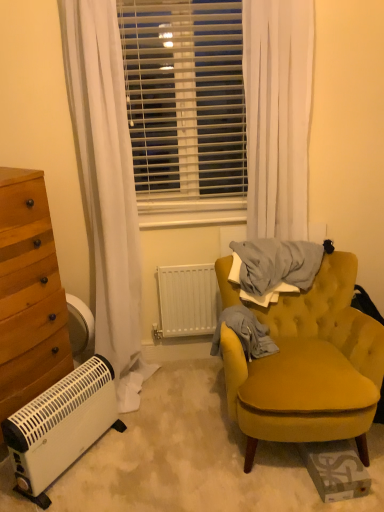
Question: From a real-world perspective, is white plastic blinds at center located higher than wooden chest of drawers at left?

Choices:
 (A) no
 (B) yes

Answer: (B)

Question: Is white plastic blinds at center far away from wooden chest of drawers at left?

Choices:
 (A) no
 (B) yes

Answer: (A)

Question: Would you say white plastic blinds at center contains wooden chest of drawers at left?

Choices:
 (A) no
 (B) yes

Answer: (A)

Question: Is white plastic blinds at center shorter than wooden chest of drawers at left?

Choices:
 (A) no
 (B) yes

Answer: (B)

Question: From a real-world perspective, is white plastic blinds at center located beneath wooden chest of drawers at left?

Choices:
 (A) no
 (B) yes

Answer: (A)

Question: Does white plastic blinds at center have a lesser width compared to wooden chest of drawers at left?

Choices:
 (A) no
 (B) yes

Answer: (B)

Question: From a real-world perspective, is velvet yellow armchair at right located beneath white sheer curtain at upper center?

Choices:
 (A) no
 (B) yes

Answer: (B)

Question: From the image's perspective, would you say velvet yellow armchair at right is positioned over white sheer curtain at upper center?

Choices:
 (A) yes
 (B) no

Answer: (B)

Question: Is velvet yellow armchair at right facing towards white sheer curtain at upper center?

Choices:
 (A) no
 (B) yes

Answer: (A)

Question: Is velvet yellow armchair at right taller than white sheer curtain at upper center?

Choices:
 (A) yes
 (B) no

Answer: (B)

Question: Is velvet yellow armchair at right closer to camera compared to white sheer curtain at upper center?

Choices:
 (A) yes
 (B) no

Answer: (A)

Question: Can you confirm if velvet yellow armchair at right is smaller than white sheer curtain at upper center?

Choices:
 (A) yes
 (B) no

Answer: (B)

Question: Is white plastic heater at lower left completely or partially outside of white sheer curtain at upper center?

Choices:
 (A) no
 (B) yes

Answer: (B)